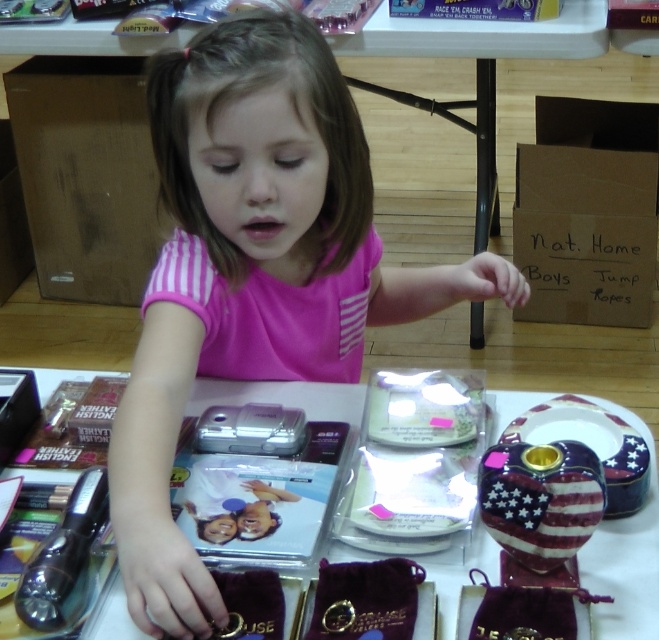
The girl is trying to decide which item to pick up first. Based on their sizes, which item is taller between the metallic silver camera at center and the metallic silver flashlight at lower left?

The metallic silver camera at center is taller than the metallic silver flashlight at lower left.

You are a photographer trying to capture the perfect shot of the pink fabric child at center and the metallic silver camera at center. Which object should you focus on first if you want to photograph them from left to right?

You should focus on the pink fabric child at center first since it is positioned on the left side of the metallic silver camera at center, making it the first object when moving from left to right.

What are the coordinates of the pink fabric child at center?

The pink fabric child at center is located at point (252,272).